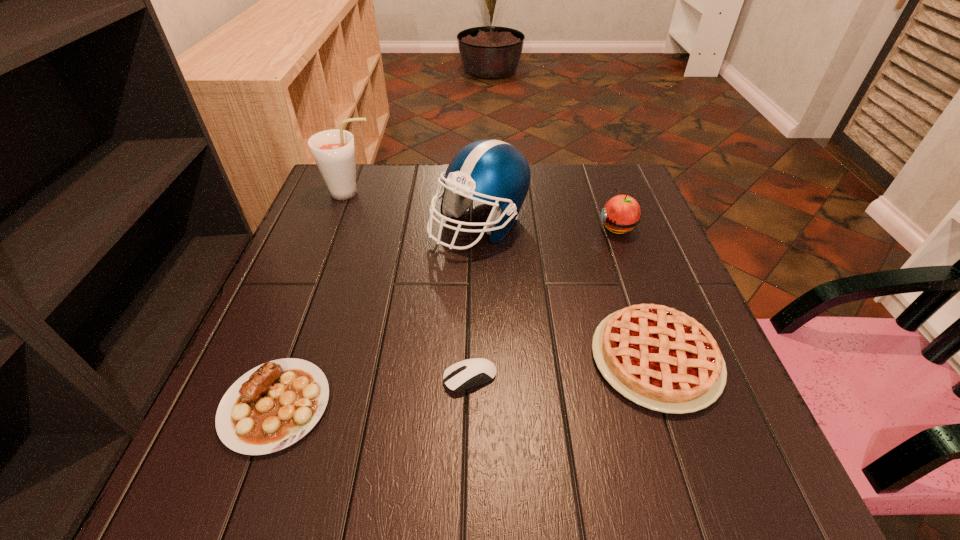
The width and height of the screenshot is (960, 540). Identify the location of free space between the mouse and the third tallest object. (543, 302).

The height and width of the screenshot is (540, 960). In order to click on vacant space that is in between the apple and the steak in this screenshot , I will do `click(446, 316)`.

Locate an element on the screen. free space that is in between the mouse and the football helmet is located at coordinates (475, 301).

The height and width of the screenshot is (540, 960). In order to click on free spot between the root beer and the steak in this screenshot , I will do `click(313, 299)`.

Where is `object that stands as the closest to the fourth shortest object`? object that stands as the closest to the fourth shortest object is located at coordinates click(x=493, y=172).

Image resolution: width=960 pixels, height=540 pixels. I want to click on object that ranks as the fifth closest to the pie, so click(x=333, y=150).

Where is `vacant space that satisfies the following two spatial constraints: 1. at the front of the football helmet with the faceguard; 2. on the left side of the fourth tallest object`? vacant space that satisfies the following two spatial constraints: 1. at the front of the football helmet with the faceguard; 2. on the left side of the fourth tallest object is located at coordinates (479, 359).

The image size is (960, 540). I want to click on free point that satisfies the following two spatial constraints: 1. on the drink side of the steak; 2. on the left side of the root beer, so click(x=270, y=406).

This screenshot has height=540, width=960. Find the location of `free spot that satisfies the following two spatial constraints: 1. on the drink side of the root beer; 2. on the right side of the mouse`. free spot that satisfies the following two spatial constraints: 1. on the drink side of the root beer; 2. on the right side of the mouse is located at coordinates (280, 378).

Where is `vacant region that satisfies the following two spatial constraints: 1. on the back side of the steak; 2. on the drink side of the root beer`? vacant region that satisfies the following two spatial constraints: 1. on the back side of the steak; 2. on the drink side of the root beer is located at coordinates (354, 193).